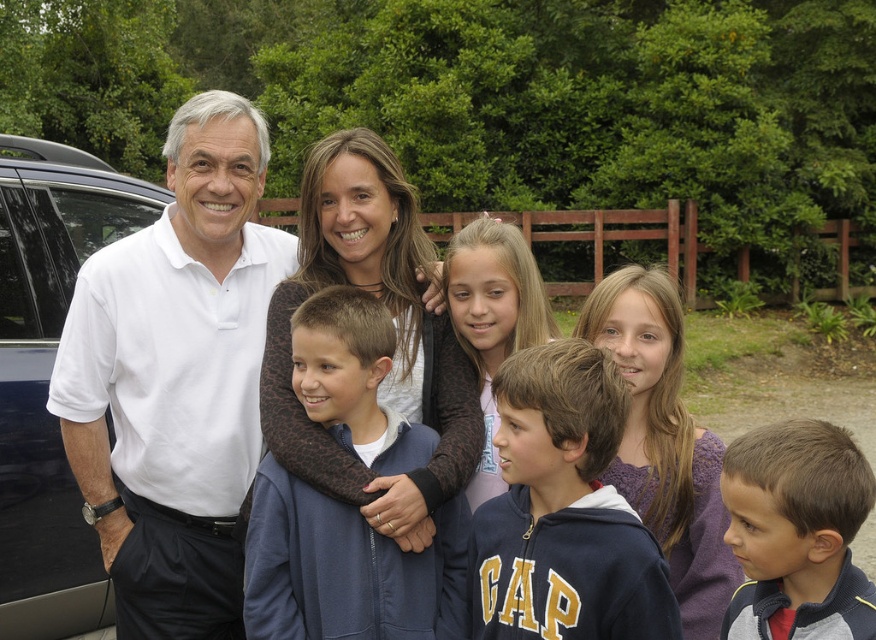
Question: Which of the following is the closest to the observer?

Choices:
 (A) white cotton shirt at left
 (B) blue fleece jacket at center

Answer: (B)

Question: Does black glossy car at left appear on the right side of gray fleece jacket at center?

Choices:
 (A) no
 (B) yes

Answer: (A)

Question: Can you confirm if black glossy car at left is positioned to the right of smooth brown hair at center?

Choices:
 (A) yes
 (B) no

Answer: (B)

Question: Which is farther from the gray fleece jacket at center?

Choices:
 (A) navy blue hoodie at center
 (B) smooth brown hair at center
 (C) black glossy car at left

Answer: (C)

Question: Can you confirm if navy blue hoodie at center is bigger than black glossy car at left?

Choices:
 (A) yes
 (B) no

Answer: (B)

Question: Which point is farther from the camera taking this photo?

Choices:
 (A) (569, 595)
 (B) (765, 612)

Answer: (A)